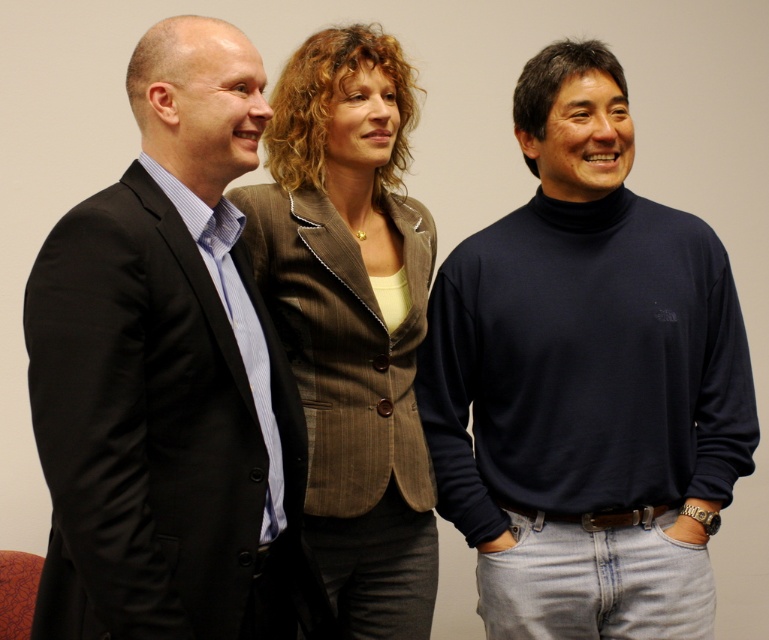
Question: Is navy turtleneck sweater at center below brown pinstripe blazer at center?

Choices:
 (A) no
 (B) yes

Answer: (B)

Question: Which point appears farthest from the camera in this image?

Choices:
 (A) (518, 456)
 (B) (323, 230)
 (C) (152, 120)

Answer: (A)

Question: Is navy turtleneck sweater at center above matte black suit at left?

Choices:
 (A) no
 (B) yes

Answer: (B)

Question: Can you confirm if navy turtleneck sweater at center is smaller than matte black suit at left?

Choices:
 (A) no
 (B) yes

Answer: (A)

Question: Which object is farther from the camera taking this photo?

Choices:
 (A) matte black suit at left
 (B) navy turtleneck sweater at center

Answer: (B)

Question: Which object is farther from the camera taking this photo?

Choices:
 (A) navy turtleneck sweater at center
 (B) matte black suit at left

Answer: (A)